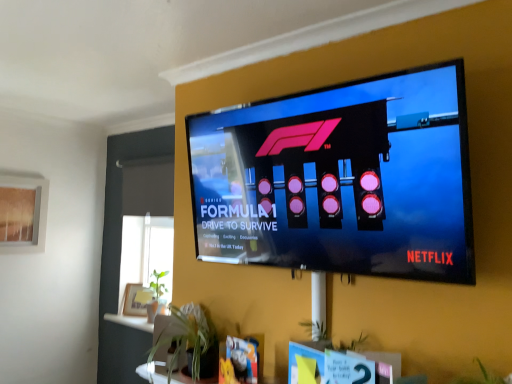
Question: From the image's perspective, is translucent glass window screen at upper left positioned above or below green leafy plant at lower center?

Choices:
 (A) above
 (B) below

Answer: (A)

Question: Does point (20, 241) appear closer or farther from the camera than point (193, 367)?

Choices:
 (A) closer
 (B) farther

Answer: (B)

Question: Based on their relative distances, which object is farther from the green leafy plant at lower center?

Choices:
 (A) translucent glass window screen at upper left
 (B) black glossy tv at upper center

Answer: (A)

Question: Which object is the closest to the translucent glass window screen at upper left?

Choices:
 (A) black glossy tv at upper center
 (B) green leafy plant at lower center

Answer: (B)